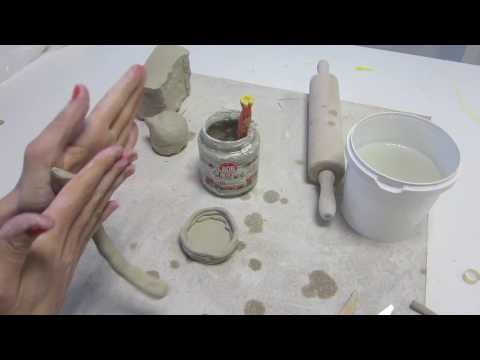
Where is `table top`? Image resolution: width=480 pixels, height=360 pixels. table top is located at coordinates (225, 48).